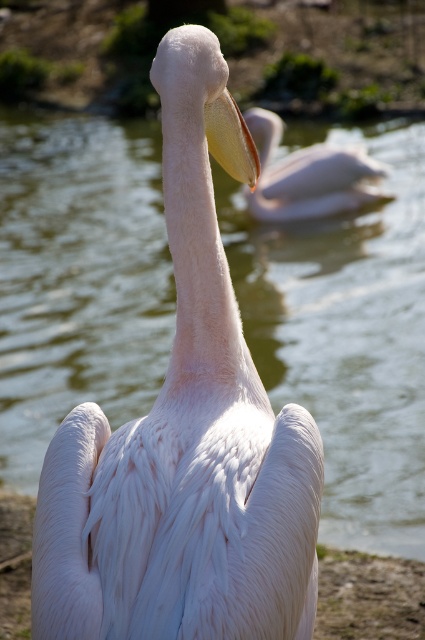
You are an ornithologist observing two pelicans in the image. The white feathered pelican at center and the white matte pelican at center. Which one appears closer to you?

The white feathered pelican at center appears closer because it is positioned under the white matte pelican at center, indicating it is in front.

You are a photographer trying to capture a closeup of the pelican in the image. The camera is focused on the point at coordinates (186, 436). What part of the pelican is the camera focusing on?

The point at coordinates (186, 436) corresponds to the white feathered pelican at center, so the camera is focusing on the white feathered pelican at center.

You are standing in a wildlife sanctuary and see the white feathered pelican at center. If you want to observe it without disturbing it, what is the minimum safe distance you should maintain?

The minimum safe distance to maintain from the white feathered pelican at center is 2 meters, as it is currently 1.99 meters away from you, which is slightly closer than the recommended safe distance.